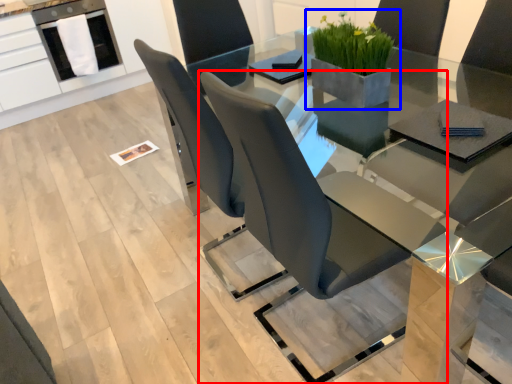
Question: Which point is further to the camera, chair (highlighted by a red box) or houseplant (highlighted by a blue box)?

Choices:
 (A) chair
 (B) houseplant

Answer: (B)